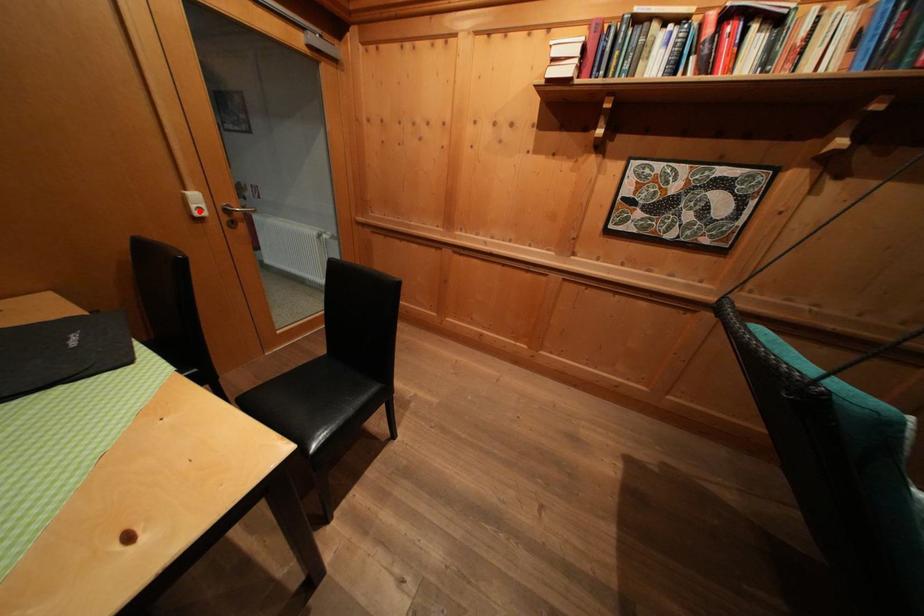
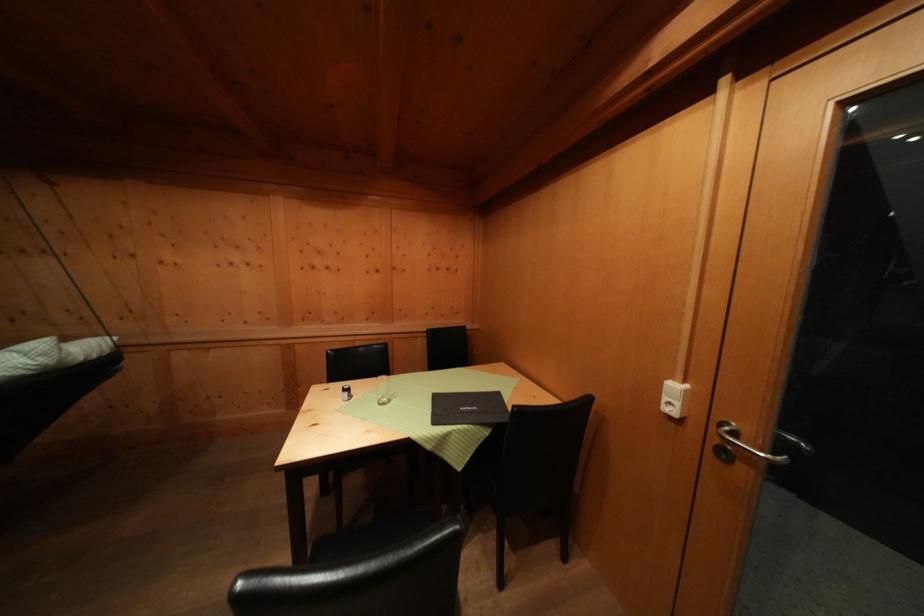
In the second image, find the point that corresponds to the highlighted location in the first image.

(672, 403)